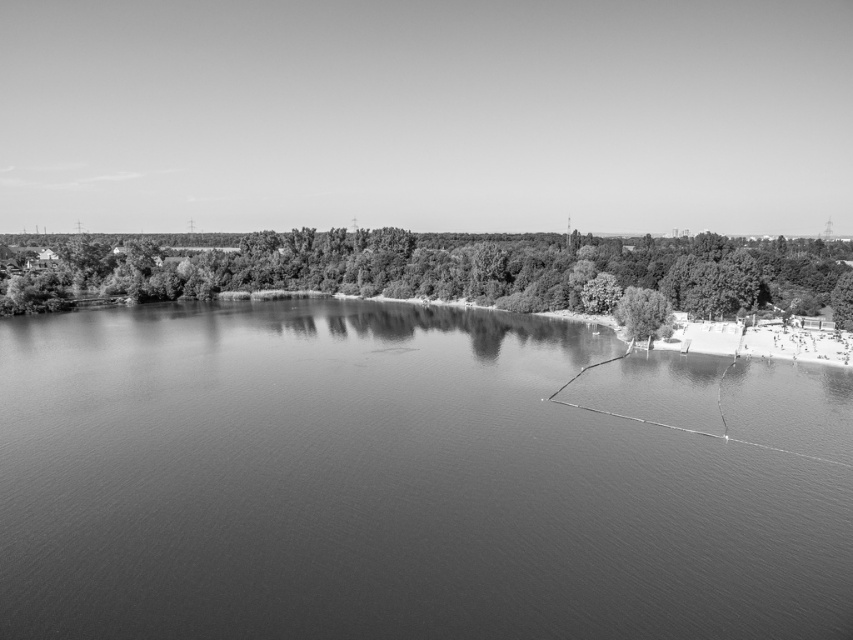
Question: Which of the following is the closest to the observer?

Choices:
 (A) green leafy tree at lower right
 (B) smooth water at lower right
 (C) green leafy tree at lower left

Answer: (B)

Question: Does green leafy tree at lower left lie behind green leafy tree at lower right?

Choices:
 (A) yes
 (B) no

Answer: (A)

Question: Estimate the real-world distances between objects in this image. Which object is farther from the green leafy tree at lower left?

Choices:
 (A) green leafy tree at lower right
 (B) smooth water at lower right

Answer: (B)

Question: Estimate the real-world distances between objects in this image. Which object is closer to the green leafy tree at lower right?

Choices:
 (A) green leafy tree at lower left
 (B) smooth water at lower right

Answer: (B)

Question: Can you confirm if smooth water at lower right is positioned below green leafy tree at lower left?

Choices:
 (A) yes
 (B) no

Answer: (A)

Question: Does green leafy tree at lower left have a larger size compared to green leafy tree at lower right?

Choices:
 (A) no
 (B) yes

Answer: (B)